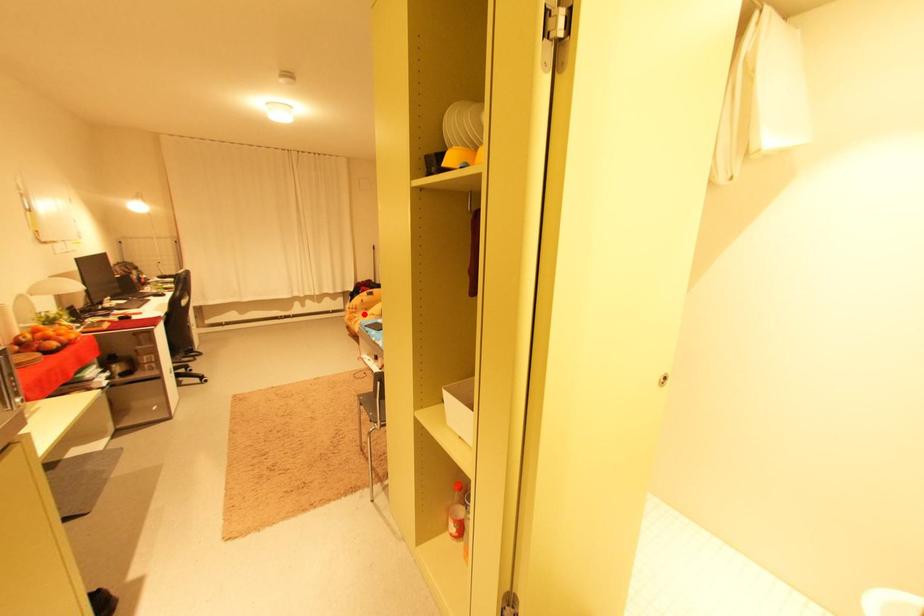
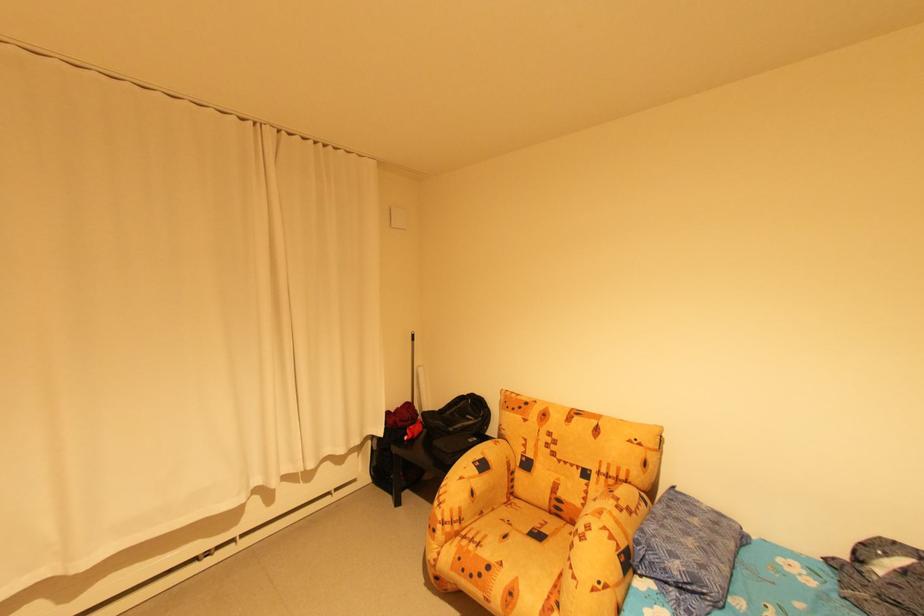
Question: I am providing you with two images of the same scene from different viewpoints. In image1, a red point is highlighted. Considering the same 3D point in image2, which of the following is correct?

Choices:
 (A) It is closer
 (B) It is farther

Answer: (A)